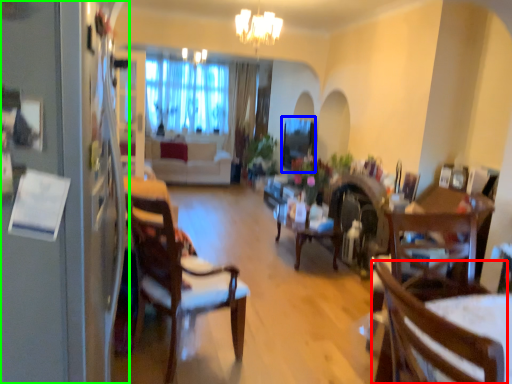
Question: Based on their relative distances, which object is farther from chair (highlighted by a red box)? Choose from window screen (highlighted by a blue box) and fridge (highlighted by a green box).

Choices:
 (A) window screen
 (B) fridge

Answer: (A)